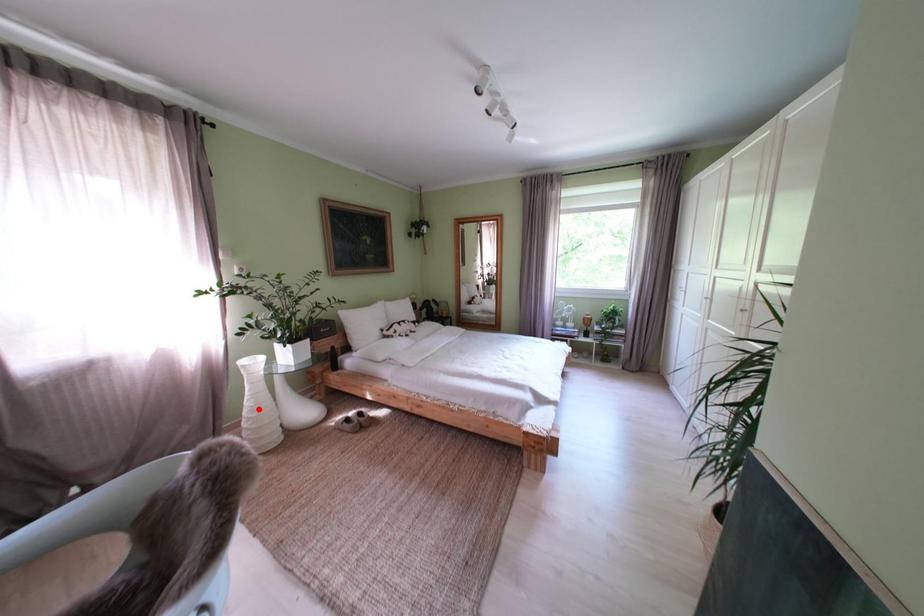
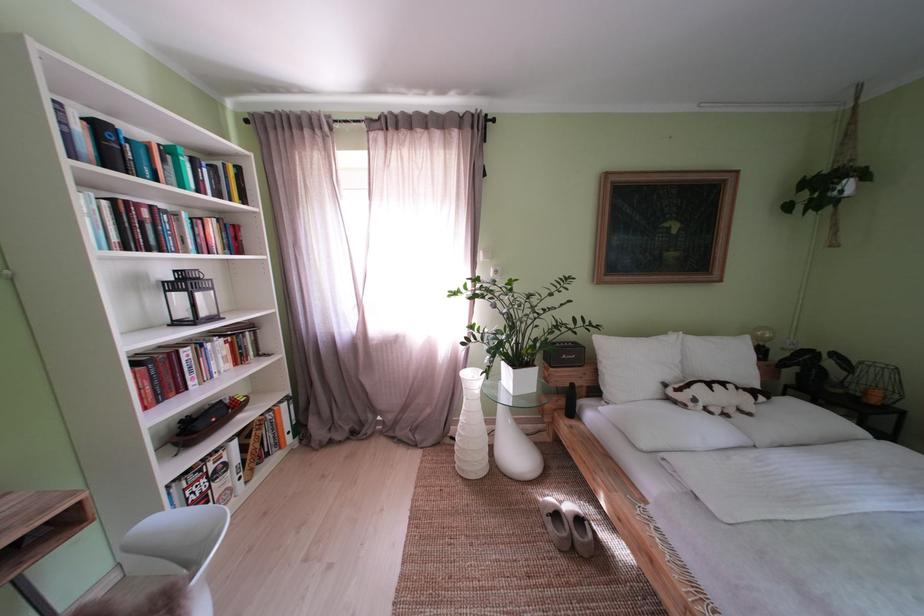
Question: A red point is marked in image1. In image2, is the corresponding 3D point closer to the camera or farther? Reply with the corresponding letter.

Choices:
 (A) The corresponding 3D point is closer.
 (B) The corresponding 3D point is farther.

Answer: (B)